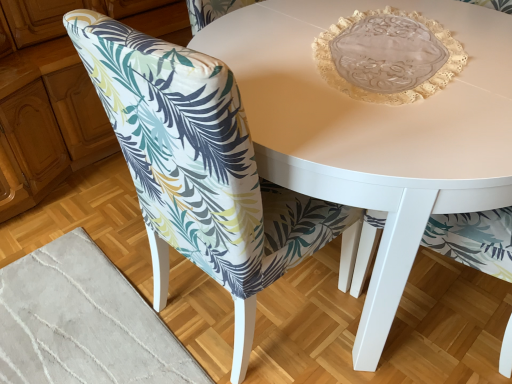
Question: Is white glossy table at center not close to printed fabric chair at lower left?

Choices:
 (A) yes
 (B) no

Answer: (B)

Question: Is white glossy table at center looking in the opposite direction of printed fabric chair at lower left?

Choices:
 (A) yes
 (B) no

Answer: (B)

Question: Considering the relative sizes of white glossy table at center and printed fabric chair at lower left in the image provided, is white glossy table at center wider than printed fabric chair at lower left?

Choices:
 (A) no
 (B) yes

Answer: (B)

Question: From the image's perspective, would you say white glossy table at center is positioned over printed fabric chair at lower left?

Choices:
 (A) yes
 (B) no

Answer: (A)

Question: Could printed fabric chair at lower left be considered to be inside white glossy table at center?

Choices:
 (A) no
 (B) yes

Answer: (B)

Question: From a real-world perspective, is white glossy table at center under printed fabric chair at lower left?

Choices:
 (A) yes
 (B) no

Answer: (A)

Question: Is printed fabric chair at lower left taller than white glossy table at center?

Choices:
 (A) yes
 (B) no

Answer: (A)

Question: Is printed fabric chair at lower left oriented away from white glossy table at center?

Choices:
 (A) yes
 (B) no

Answer: (A)

Question: Can you confirm if printed fabric chair at lower left is positioned to the left of white glossy table at center?

Choices:
 (A) yes
 (B) no

Answer: (A)

Question: Is printed fabric chair at lower left beside white glossy table at center?

Choices:
 (A) yes
 (B) no

Answer: (B)

Question: Is printed fabric chair at lower left smaller than white glossy table at center?

Choices:
 (A) yes
 (B) no

Answer: (A)

Question: Does printed fabric chair at lower left have a larger size compared to white glossy table at center?

Choices:
 (A) no
 (B) yes

Answer: (A)

Question: From the image's perspective, is printed fabric chair at lower left located above or below white glossy table at center?

Choices:
 (A) above
 (B) below

Answer: (B)